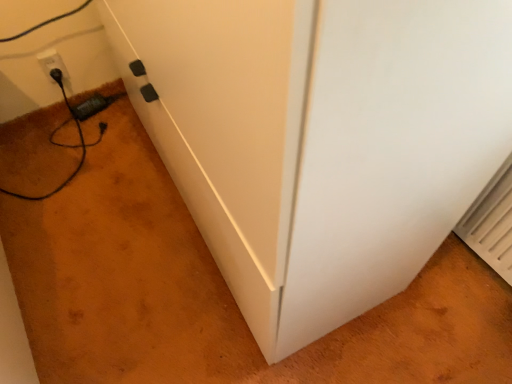
Question: Considering the relative positions of white plastic outlet at lower left and black plastic plug at lower left in the image provided, is white plastic outlet at lower left to the left or to the right of black plastic plug at lower left?

Choices:
 (A) left
 (B) right

Answer: (A)

Question: Is white plastic outlet at lower left taller or shorter than black plastic plug at lower left?

Choices:
 (A) tall
 (B) short

Answer: (A)

Question: From a real-world perspective, is white plastic outlet at lower left positioned above or below black plastic plug at lower left?

Choices:
 (A) below
 (B) above

Answer: (B)

Question: Considering the relative positions of black plastic plug at lower left and white plastic outlet at lower left in the image provided, is black plastic plug at lower left to the left or to the right of white plastic outlet at lower left?

Choices:
 (A) left
 (B) right

Answer: (B)

Question: Is black plastic plug at lower left inside the boundaries of white plastic outlet at lower left, or outside?

Choices:
 (A) outside
 (B) inside

Answer: (A)

Question: Considering their positions, is black plastic plug at lower left located in front of or behind white plastic outlet at lower left?

Choices:
 (A) behind
 (B) front

Answer: (A)

Question: Does point (92, 102) appear closer or farther from the camera than point (51, 49)?

Choices:
 (A) farther
 (B) closer

Answer: (A)